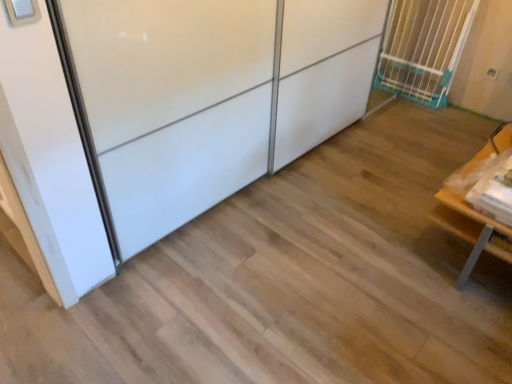
Question: Is wooden table at right facing away from white glossy sliding door at upper left?

Choices:
 (A) no
 (B) yes

Answer: (A)

Question: Is wooden table at right positioned in front of white glossy sliding door at upper left?

Choices:
 (A) no
 (B) yes

Answer: (A)

Question: Can we say wooden table at right lies outside white glossy sliding door at upper left?

Choices:
 (A) yes
 (B) no

Answer: (A)

Question: Does wooden table at right have a larger size compared to white glossy sliding door at upper left?

Choices:
 (A) no
 (B) yes

Answer: (A)

Question: From a real-world perspective, is wooden table at right located higher than white glossy sliding door at upper left?

Choices:
 (A) no
 (B) yes

Answer: (A)

Question: From the image's perspective, is wooden table at right positioned above or below white glossy sliding door at upper left?

Choices:
 (A) above
 (B) below

Answer: (B)

Question: Which is correct: wooden table at right is inside white glossy sliding door at upper left, or outside of it?

Choices:
 (A) outside
 (B) inside

Answer: (A)

Question: In terms of size, does wooden table at right appear bigger or smaller than white glossy sliding door at upper left?

Choices:
 (A) small
 (B) big

Answer: (A)

Question: Looking at their shapes, would you say wooden table at right is wider or thinner than white glossy sliding door at upper left?

Choices:
 (A) wide
 (B) thin

Answer: (A)

Question: From a real-world perspective, is white glossy sliding door at upper left positioned above or below white plastic gate at upper right?

Choices:
 (A) above
 (B) below

Answer: (A)

Question: In the image, is white glossy sliding door at upper left positioned in front of or behind white plastic gate at upper right?

Choices:
 (A) front
 (B) behind

Answer: (A)

Question: In the image, is white glossy sliding door at upper left on the left side or the right side of white plastic gate at upper right?

Choices:
 (A) left
 (B) right

Answer: (A)

Question: From the image's perspective, is white glossy sliding door at upper left positioned above or below white plastic gate at upper right?

Choices:
 (A) below
 (B) above

Answer: (A)

Question: Relative to wooden table at right, is white glossy sliding door at upper left in front or behind?

Choices:
 (A) front
 (B) behind

Answer: (A)

Question: Does point (234, 137) appear closer or farther from the camera than point (502, 132)?

Choices:
 (A) closer
 (B) farther

Answer: (A)